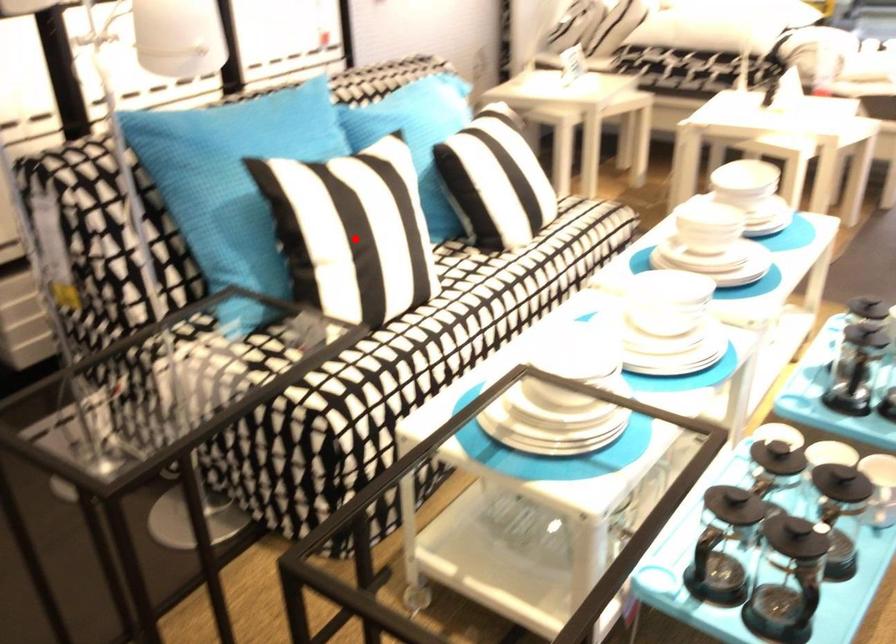
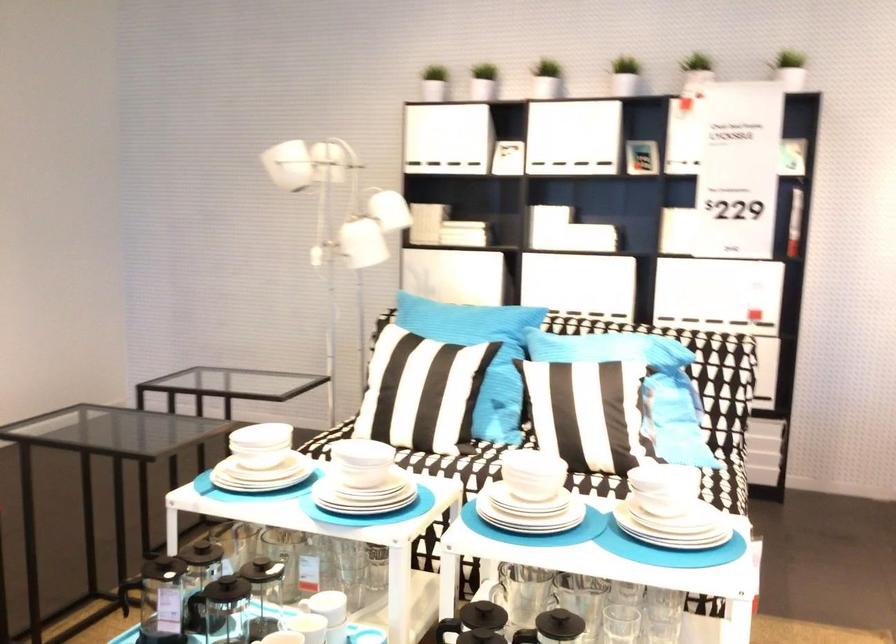
Question: I am providing you with two images of the same scene from different viewpoints. A red point is shown in image1. For the corresponding object point in image2, is it positioned nearer or farther from the camera?

Choices:
 (A) Nearer
 (B) Farther

Answer: (B)